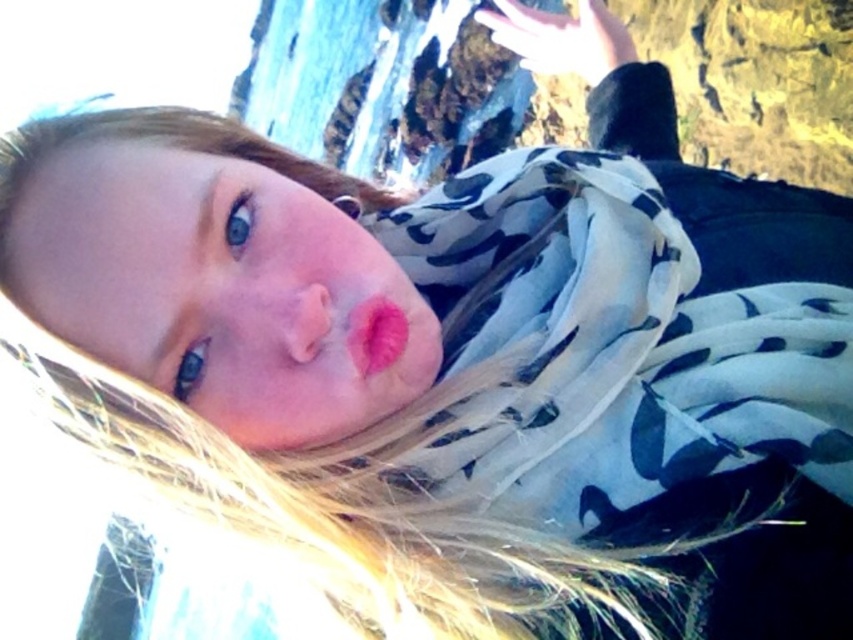
You are a photographer trying to capture a close detail shot of the person in the image. You need to focus on the object that is smaller between the white floral scarf at center and the matte pink lipstick at center. Which object should you choose?

The matte pink lipstick at center is smaller than the white floral scarf at center, so you should focus on the matte pink lipstick at center for the detail shot.

You are a photographer adjusting your camera settings to focus on the white floral scarf at center and the matte pink lipstick at center. Which object should you focus on first to ensure both are in sharp focus?

You should focus on the white floral scarf at center first because it is closer to the viewer than the matte pink lipstick at center, allowing the depth of field to cover both objects effectively.